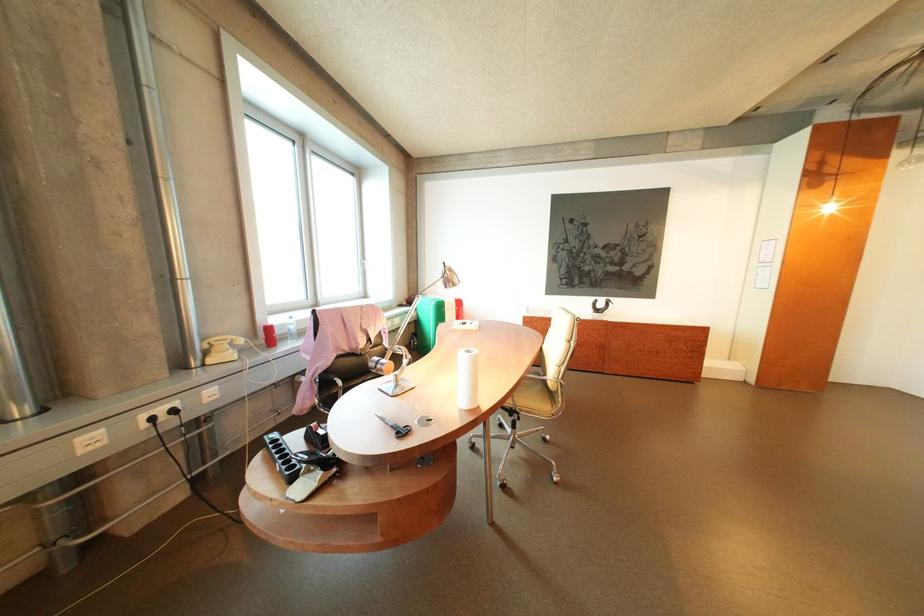
Find where to open the plastic water bottle. Please return your answer as a coordinate pair (x, y).

(290, 329)